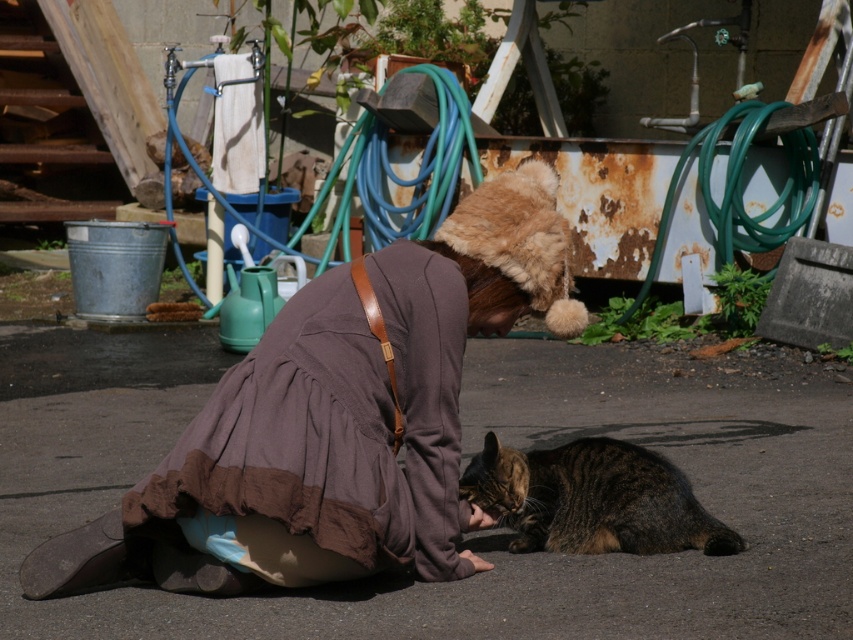
Question: Can you confirm if tabby fur cat at lower center is smaller than blue rubber hose at upper center?

Choices:
 (A) no
 (B) yes

Answer: (B)

Question: Estimate the real-world distances between objects in this image. Which object is farther from the blue rubber hose at upper center?

Choices:
 (A) brown cotton robe at center
 (B) tabby fur cat at lower center

Answer: (A)

Question: Is the position of tabby fur cat at lower center more distant than that of green rubber hose at upper right?

Choices:
 (A) no
 (B) yes

Answer: (A)

Question: Among these points, which one is farthest from the camera?

Choices:
 (A) (381, 284)
 (B) (526, 525)
 (C) (430, 148)
 (D) (746, 227)

Answer: (C)

Question: Where is green rubber hose at upper right located in relation to blue rubber hose at upper center in the image?

Choices:
 (A) above
 (B) below

Answer: (B)

Question: Which of the following is the closest to the observer?

Choices:
 (A) blue rubber hose at upper center
 (B) tabby fur cat at lower center
 (C) brown cotton robe at center
 (D) green rubber hose at upper right

Answer: (C)